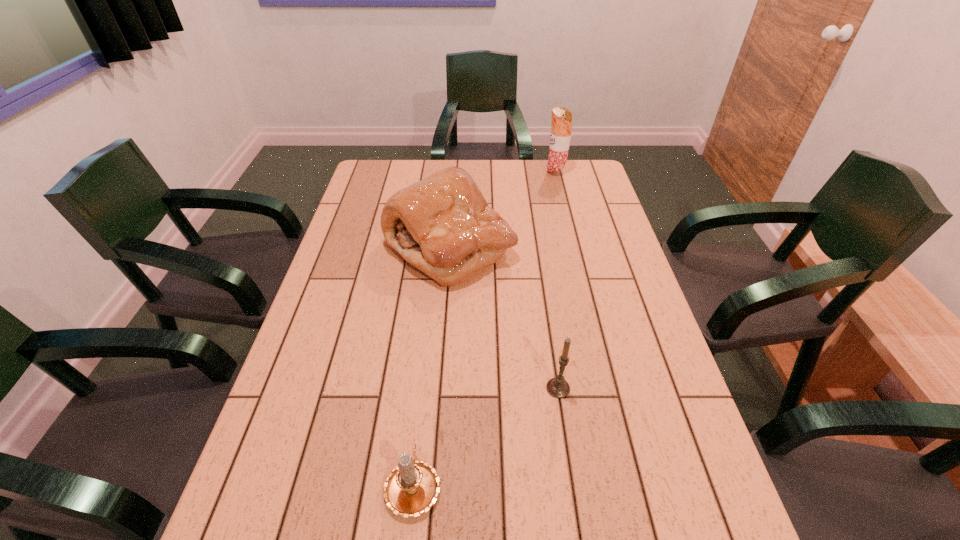
Identify the location of vacant space in between the third object from left to right and the nearer candle. (486, 436).

What are the coordinates of `vacant area between the nearest object and the third tallest object` in the screenshot? It's located at (486, 436).

The width and height of the screenshot is (960, 540). What are the coordinates of `vacant area that lies between the farther candle and the shorter candle` in the screenshot? It's located at (486, 436).

Identify the location of vacant space that is in between the tallest object and the nearer candle. (485, 328).

Locate an element on the screen. Image resolution: width=960 pixels, height=540 pixels. free space between the second tallest object and the second shortest object is located at coordinates (504, 318).

The height and width of the screenshot is (540, 960). Identify the location of free spot between the bread and the right candle. (504, 318).

Where is `vacant space that's between the bread and the farthest object`? Image resolution: width=960 pixels, height=540 pixels. vacant space that's between the bread and the farthest object is located at coordinates (503, 210).

Where is `empty space that is in between the shorter candle and the farther candle`? empty space that is in between the shorter candle and the farther candle is located at coordinates (486, 436).

The width and height of the screenshot is (960, 540). In order to click on free space between the left candle and the burrito in this screenshot , I will do `click(485, 328)`.

Where is `free space between the tallest object and the third shortest object`? The image size is (960, 540). free space between the tallest object and the third shortest object is located at coordinates (503, 210).